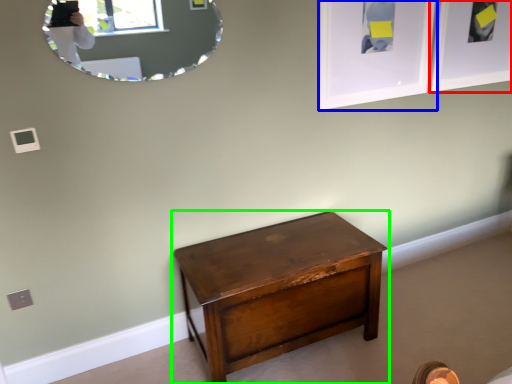
Question: Which object is positioned farthest from picture frame (highlighted by a red box)? Select from picture frame (highlighted by a blue box) and nightstand (highlighted by a green box).

Choices:
 (A) picture frame
 (B) nightstand

Answer: (B)